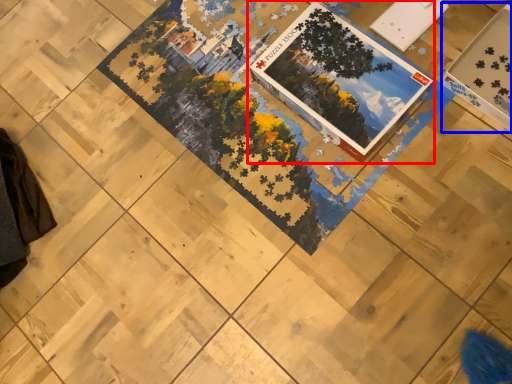
Question: Which object is closer to the camera taking this photo, book (highlighted by a red box) or square (highlighted by a blue box)?

Choices:
 (A) book
 (B) square

Answer: (B)